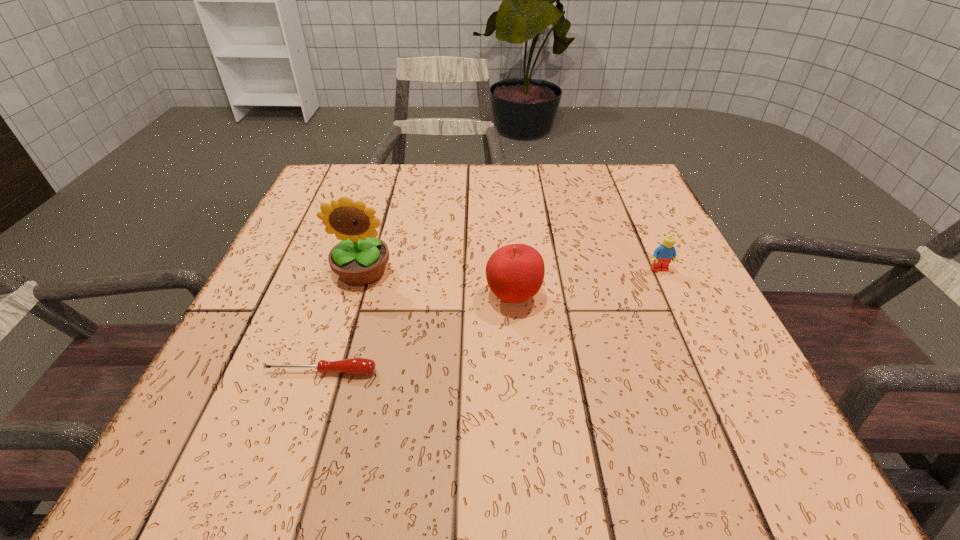
At what (x,y) coordinates should I click in order to perform the action: click on free space at the near right corner of the desktop. Please return your answer as a coordinate pair (x, y). The height and width of the screenshot is (540, 960). Looking at the image, I should click on pos(755,455).

Identify the location of vacant point located between the Lego and the shortest object. The image size is (960, 540). (491, 321).

Find the location of a particular element. The image size is (960, 540). free space between the second object from right to left and the tallest object is located at coordinates (438, 285).

The width and height of the screenshot is (960, 540). Identify the location of free area in between the second object from right to left and the screwdriver. (418, 334).

Where is `vacant area that lies between the third object from left to right and the sunflower`? vacant area that lies between the third object from left to right and the sunflower is located at coordinates (438, 285).

The width and height of the screenshot is (960, 540). In order to click on empty space between the apple and the shortest object in this screenshot , I will do `click(418, 334)`.

Find the location of a particular element. free space between the second object from right to left and the Lego is located at coordinates (587, 284).

Locate an element on the screen. empty location between the second tallest object and the tallest object is located at coordinates (438, 285).

You are a GUI agent. You are given a task and a screenshot of the screen. Output one action in this format:
    pyautogui.click(x=<x>, y=<y>)
    Task: Click on the object that is the third closest to the third tallest object
    The height and width of the screenshot is (540, 960).
    Given the screenshot: What is the action you would take?
    pyautogui.click(x=355, y=366)

Where is `the second closest object relative to the Lego`? The width and height of the screenshot is (960, 540). the second closest object relative to the Lego is located at coordinates (360, 259).